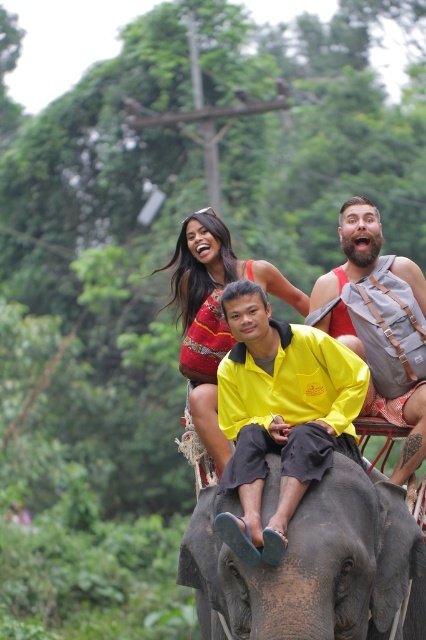
You are a photographer trying to capture a clear photo of the yellow matte shirt at center and the bearded man with backpack at upper right. Which of the two subjects should you focus on first if you want to ensure both are in focus without adjusting the camera settings?

The yellow matte shirt at center is smaller than the bearded man with backpack at upper right, so you should focus on the bearded man with backpack at upper right first since it is larger and easier to capture clearly.